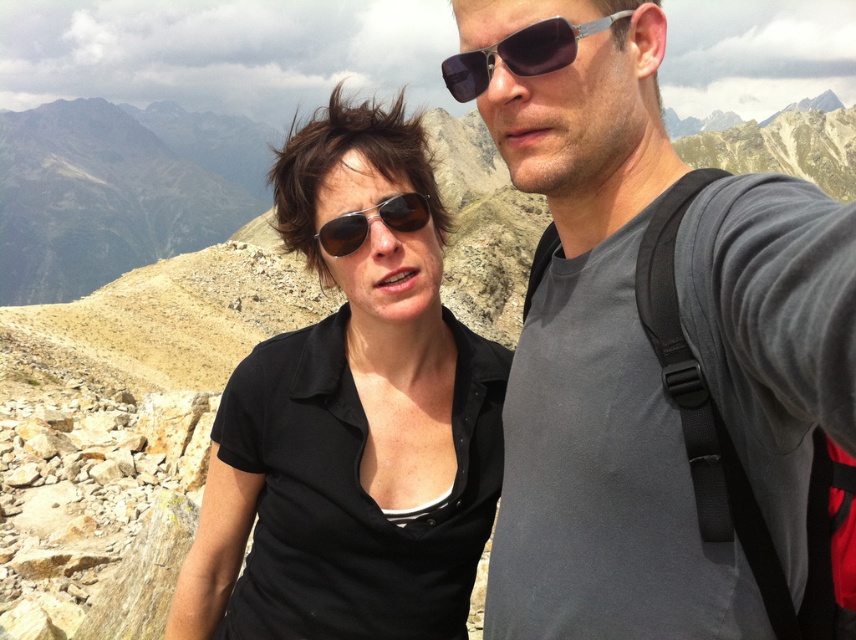
Who is more forward, [685,628] or [385,220]?

Positioned in front is point [685,628].

Between gray matte t-shirt at center and matte black sunglasses at center, which one is positioned higher?

matte black sunglasses at center is above.

Is point (569, 157) positioned before point (403, 227)?

Yes, point (569, 157) is closer to viewer.

Where is `gray matte t-shirt at center`? Image resolution: width=856 pixels, height=640 pixels. gray matte t-shirt at center is located at coordinates 593,355.

Between gray matte t-shirt at center and sunglasses at center, which one is positioned lower?

gray matte t-shirt at center is lower down.

Image resolution: width=856 pixels, height=640 pixels. I want to click on gray matte t-shirt at center, so click(593, 355).

Does gray matte t-shirt at center appear under black matte shirt at center?

Incorrect, gray matte t-shirt at center is not positioned below black matte shirt at center.

Which is behind, point (592, 13) or point (385, 189)?

Positioned behind is point (385, 189).

Locate an element on the screen. This screenshot has width=856, height=640. gray matte t-shirt at center is located at coordinates (593, 355).